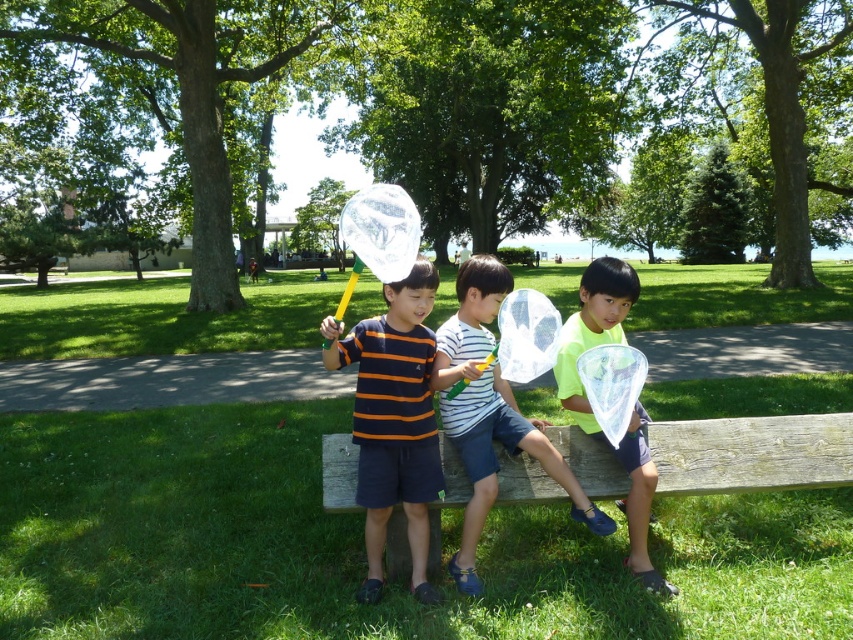
Which is below, wooden bench at center or neon yellow shirt at center?

Positioned lower is wooden bench at center.

Is point (828, 460) in front of point (579, 316)?

That is False.

Where is `wooden bench at center`? The height and width of the screenshot is (640, 853). wooden bench at center is located at coordinates (752, 452).

Between striped cotton shirt at center and neon yellow shirt at center, which one has more height?

Standing taller between the two is striped cotton shirt at center.

Does point (431, 397) come farther from viewer compared to point (598, 268)?

No, it is not.

Measure the distance between striped cotton shirt at center and camera.

A distance of 9.12 feet exists between striped cotton shirt at center and camera.

This screenshot has height=640, width=853. What are the coordinates of `striped cotton shirt at center` in the screenshot? It's located at (393, 420).

Between neon yellow t-shirt at center and neon yellow shirt at center, which one is positioned lower?

neon yellow t-shirt at center is lower down.

Can you confirm if neon yellow t-shirt at center is wider than neon yellow shirt at center?

Yes.

Is point (541, 452) less distant than point (577, 342)?

Yes, point (541, 452) is in front of point (577, 342).

Locate an element on the screen. The width and height of the screenshot is (853, 640). neon yellow t-shirt at center is located at coordinates (489, 412).